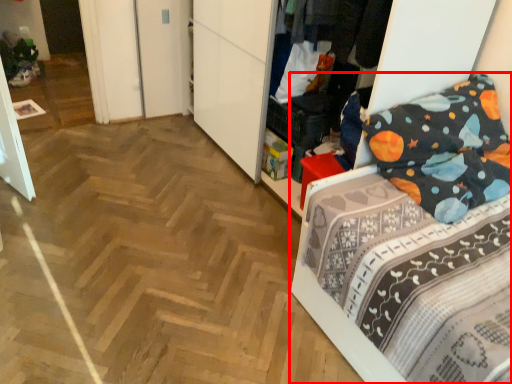
Question: Considering the relative positions of bed (annotated by the red box) and clothing in the image provided, where is bed (annotated by the red box) located with respect to the staircase?

Choices:
 (A) right
 (B) left

Answer: (A)